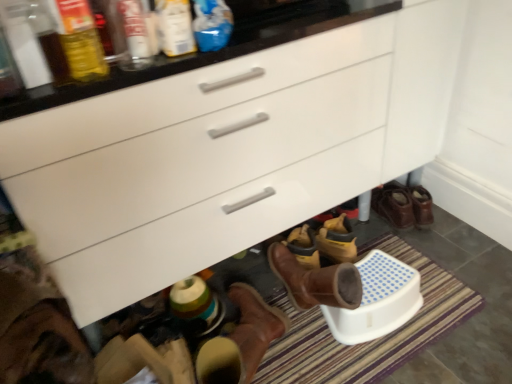
Question: Does matte plastic bottle at upper center, the 3th bottle when ordered from left to right, have a larger size compared to translucent plastic bottle at upper left, the third bottle from the right?

Choices:
 (A) no
 (B) yes

Answer: (A)

Question: Can you confirm if matte plastic bottle at upper center, positioned as the second bottle in right-to-left order, is positioned to the left of translucent plastic bottle at upper left, which appears as the second bottle when viewed from the left?

Choices:
 (A) no
 (B) yes

Answer: (A)

Question: Can you see matte plastic bottle at upper center, positioned as the second bottle in right-to-left order, touching translucent plastic bottle at upper left, the third bottle from the right?

Choices:
 (A) no
 (B) yes

Answer: (A)

Question: Could translucent plastic bottle at upper left, the third bottle from the right, be considered to be inside matte plastic bottle at upper center, the 3th bottle when ordered from left to right?

Choices:
 (A) no
 (B) yes

Answer: (A)

Question: Does matte plastic bottle at upper center, positioned as the second bottle in right-to-left order, lie in front of translucent plastic bottle at upper left, which appears as the second bottle when viewed from the left?

Choices:
 (A) yes
 (B) no

Answer: (B)

Question: Would you say matte glass bottle at upper left, which ranks as the fourth bottle in right-to-left order, is inside or outside blue plastic bottle at upper center, which appears as the first bottle when viewed from the right?

Choices:
 (A) outside
 (B) inside

Answer: (A)

Question: Considering their positions, is matte glass bottle at upper left, the first bottle viewed from the left, located in front of or behind blue plastic bottle at upper center, the fourth bottle in the left-to-right sequence?

Choices:
 (A) front
 (B) behind

Answer: (A)

Question: From a real-world perspective, relative to blue plastic bottle at upper center, which appears as the first bottle when viewed from the right, is matte glass bottle at upper left, which ranks as the fourth bottle in right-to-left order, vertically above or below?

Choices:
 (A) above
 (B) below

Answer: (A)

Question: Is matte glass bottle at upper left, the first bottle viewed from the left, bigger or smaller than blue plastic bottle at upper center, the fourth bottle in the left-to-right sequence?

Choices:
 (A) small
 (B) big

Answer: (B)

Question: Is translucent plastic bottle at upper left, the third bottle from the right, wider or thinner than striped carpet at lower center?

Choices:
 (A) thin
 (B) wide

Answer: (A)

Question: From a real-world perspective, is translucent plastic bottle at upper left, the third bottle from the right, physically located above or below striped carpet at lower center?

Choices:
 (A) below
 (B) above

Answer: (B)

Question: Which is correct: translucent plastic bottle at upper left, which appears as the second bottle when viewed from the left, is inside striped carpet at lower center, or outside of it?

Choices:
 (A) outside
 (B) inside

Answer: (A)

Question: From the image's perspective, is translucent plastic bottle at upper left, the third bottle from the right, above or below striped carpet at lower center?

Choices:
 (A) above
 (B) below

Answer: (A)

Question: Visually, is matte glass bottle at upper left, which ranks as the fourth bottle in right-to-left order, positioned to the left or to the right of translucent plastic bottle at upper left, the third bottle from the right?

Choices:
 (A) left
 (B) right

Answer: (A)

Question: In terms of width, does matte glass bottle at upper left, the first bottle viewed from the left, look wider or thinner when compared to translucent plastic bottle at upper left, which appears as the second bottle when viewed from the left?

Choices:
 (A) wide
 (B) thin

Answer: (B)